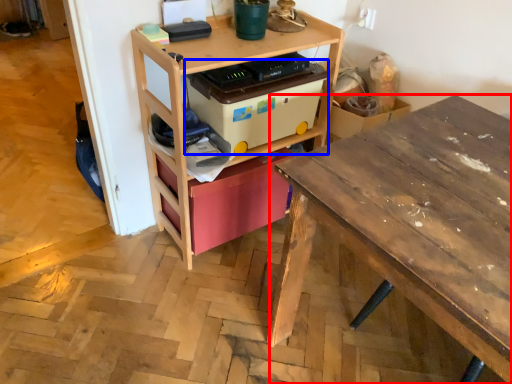
Question: Which object appears closest to the camera in this image, desk (highlighted by a red box) or storage box (highlighted by a blue box)?

Choices:
 (A) desk
 (B) storage box

Answer: (A)